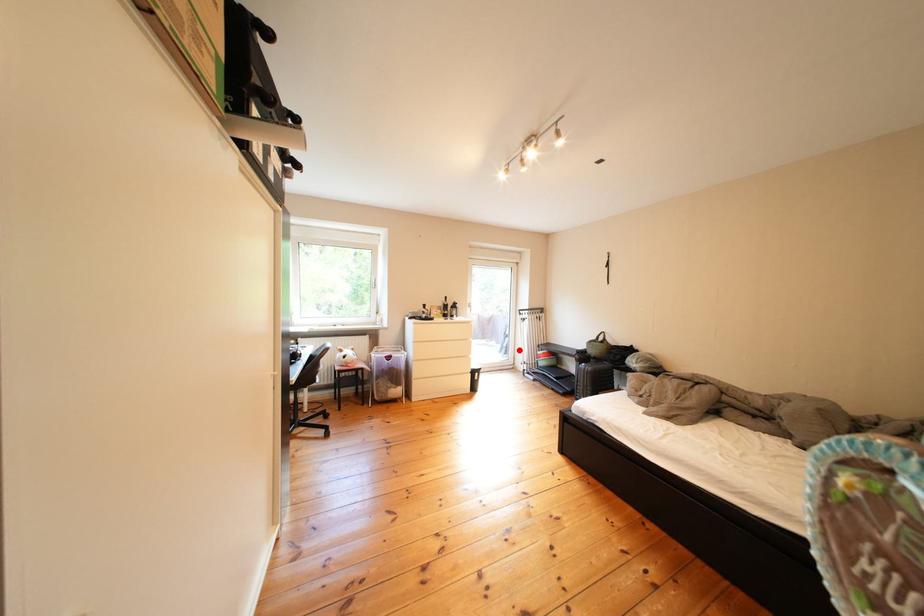
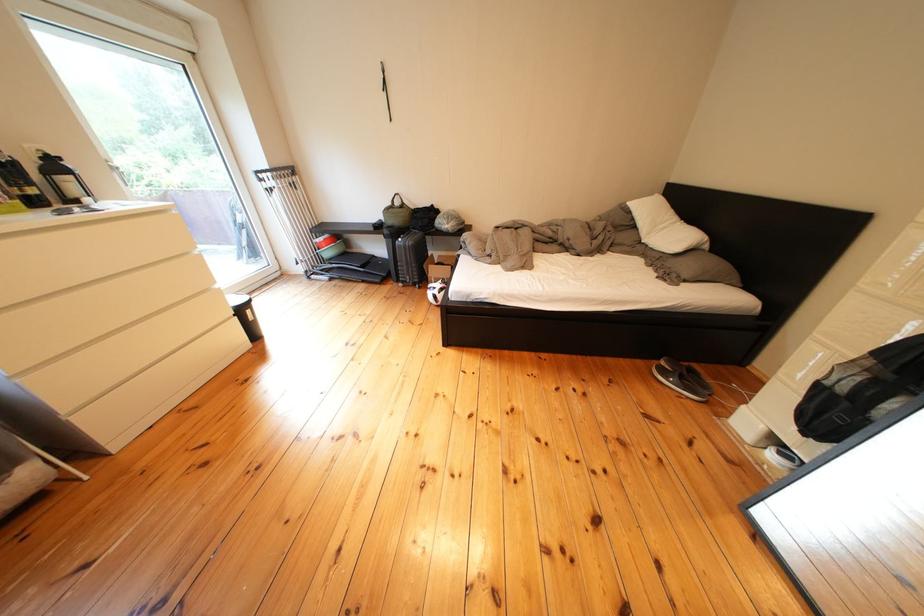
Question: I am providing you with two images of the same scene from different viewpoints. Image1 has a red point marked. In image2, the corresponding 3D location appears at what relative position? Reply with the corresponding letter.

Choices:
 (A) Closer
 (B) Farther

Answer: (A)